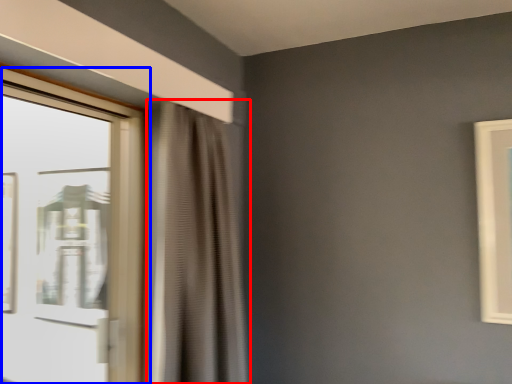
Question: Which point is closer to the camera, curtain (highlighted by a red box) or window (highlighted by a blue box)?

Choices:
 (A) curtain
 (B) window

Answer: (B)